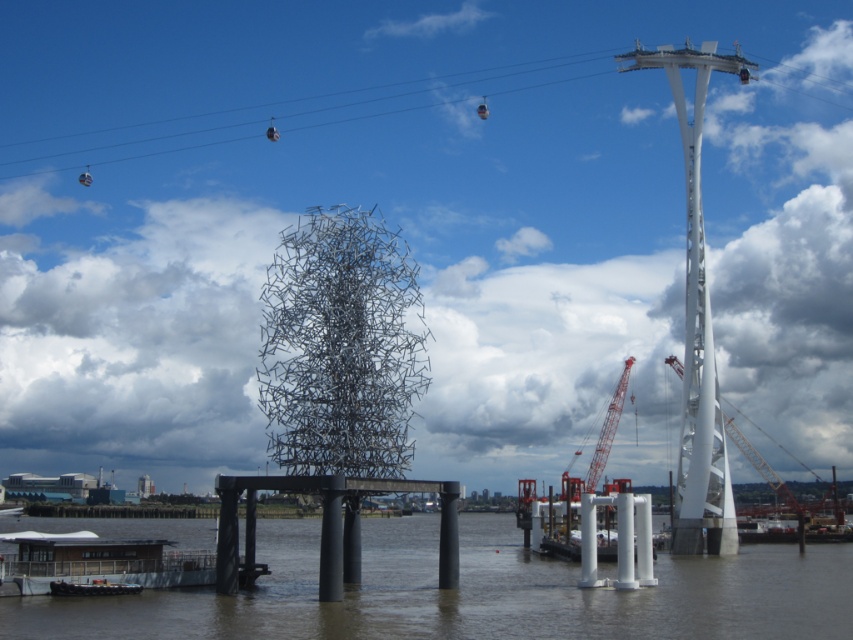
Question: Which object is farther from the camera taking this photo?

Choices:
 (A) red metallic crane at center
 (B) black matte dock at center
 (C) metallic cable car at upper center

Answer: (C)

Question: Which object is farther from the camera taking this photo?

Choices:
 (A) white metallic crane at center right
 (B) white matte boat at lower left
 (C) red metallic crane at center

Answer: (A)

Question: In this image, where is white matte boat at lower left located relative to red metallic crane at center?

Choices:
 (A) above
 (B) below

Answer: (B)

Question: Which object is positioned closest to the white metallic crane at center right?

Choices:
 (A) metallic cable car at upper center
 (B) metallic gray boat at lower left
 (C) brown murky water at center
 (D) white matte boat at lower left

Answer: (C)

Question: Does brown murky water at center lie behind black matte dock at center?

Choices:
 (A) yes
 (B) no

Answer: (B)

Question: Is black matte dock at center below metallic cable car at upper center?

Choices:
 (A) yes
 (B) no

Answer: (A)